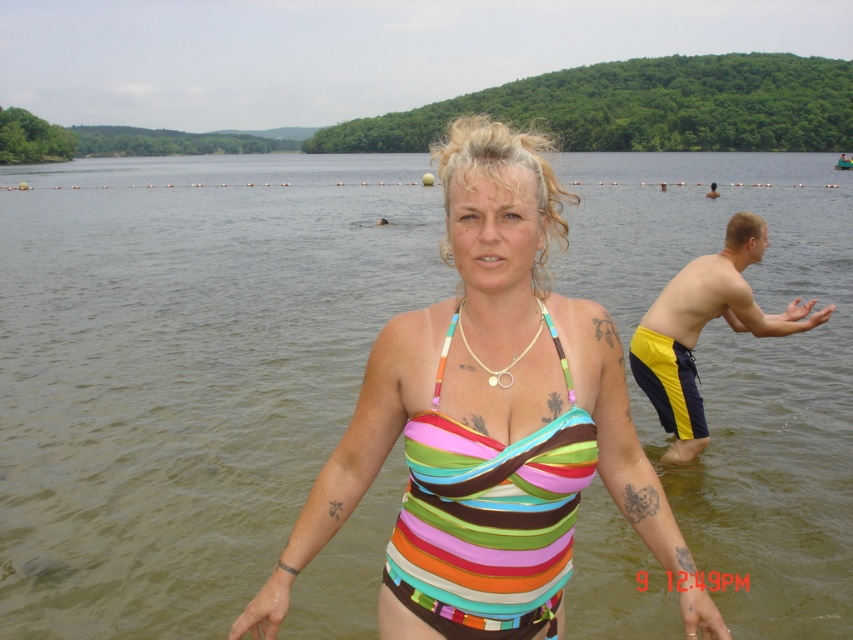
Which of these two, multicolored striped swimsuit at center or multicolored fabric bikini top at center, stands taller?

With more height is multicolored striped swimsuit at center.

Describe the element at coordinates (485, 420) in the screenshot. The width and height of the screenshot is (853, 640). I see `multicolored striped swimsuit at center` at that location.

This screenshot has height=640, width=853. Identify the location of multicolored striped swimsuit at center. (485, 420).